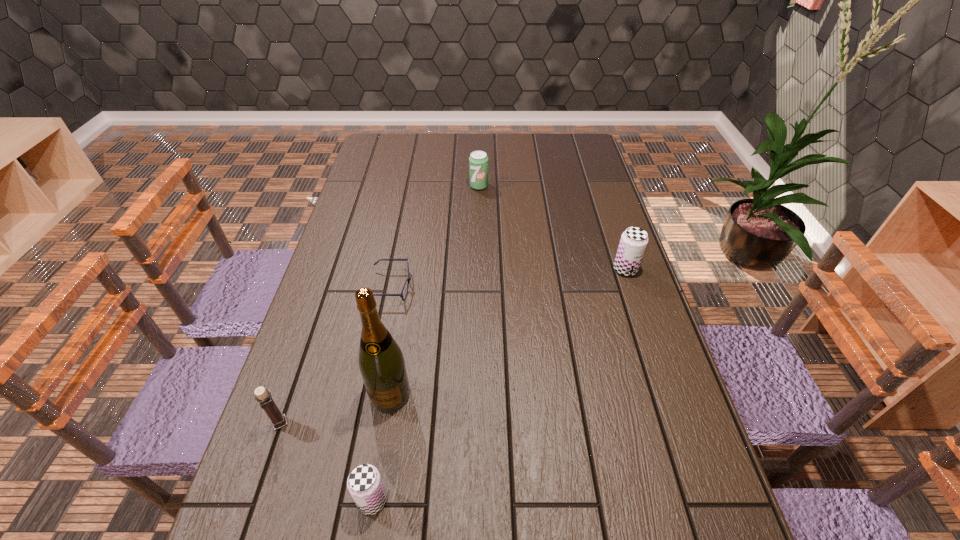
This screenshot has width=960, height=540. Find the location of `the fifth tallest object`. the fifth tallest object is located at coordinates (364, 483).

At what (x,y) coordinates should I click in order to perform the action: click on the left beer can. Please return your answer as a coordinate pair (x, y). Looking at the image, I should click on (364, 483).

Locate an element on the screen. the farther beer can is located at coordinates (633, 242).

This screenshot has height=540, width=960. I want to click on the taller beer can, so click(x=633, y=242).

Identify the location of soda. (478, 161).

This screenshot has height=540, width=960. I want to click on the fifth object from left to right, so click(478, 161).

Locate an element on the screen. the shortest object is located at coordinates (408, 279).

At what (x,y) coordinates should I click in order to perform the action: click on the leftmost object. Please return your answer as a coordinate pair (x, y). The width and height of the screenshot is (960, 540). Looking at the image, I should click on (263, 396).

Locate an element on the screen. This screenshot has height=540, width=960. candle holder is located at coordinates (263, 396).

The image size is (960, 540). Find the location of `the tallest object`. the tallest object is located at coordinates (381, 362).